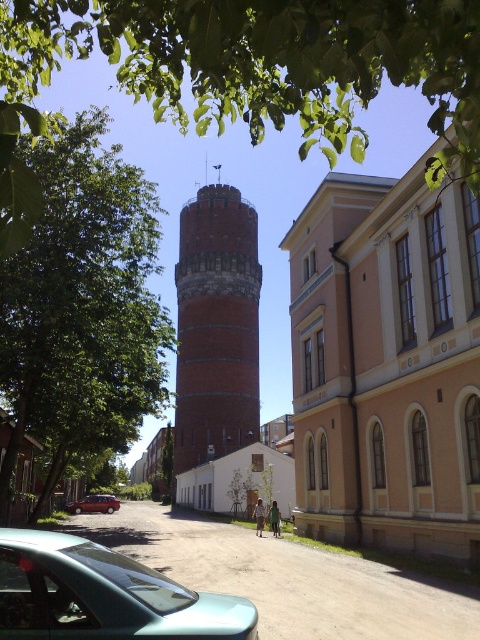
Question: Is brick textured tower at center behind teal matte car at lower left?

Choices:
 (A) yes
 (B) no

Answer: (A)

Question: Which point is farther from the camera taking this photo?

Choices:
 (A) (96, 504)
 (B) (271, 61)
 (C) (226, 605)
 (D) (219, 269)

Answer: (D)

Question: Does green leafy tree at center appear on the right side of teal matte car at lower left?

Choices:
 (A) yes
 (B) no

Answer: (A)

Question: Which object is the closest to the teal matte car at lower left?

Choices:
 (A) green leafy tree at upper center
 (B) brick textured tower at center
 (C) teal glossy car at lower left
 (D) green leafy tree at center

Answer: (B)

Question: Which point appears farthest from the camera in this image?

Choices:
 (A) (113, 596)
 (B) (44, 404)

Answer: (B)

Question: Is green leafy tree at center to the left of teal glossy car at lower left from the viewer's perspective?

Choices:
 (A) yes
 (B) no

Answer: (A)